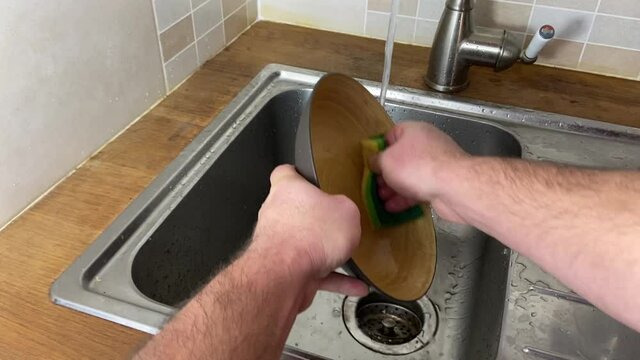
I want to click on tile wall to left of sink, so click(184, 38).